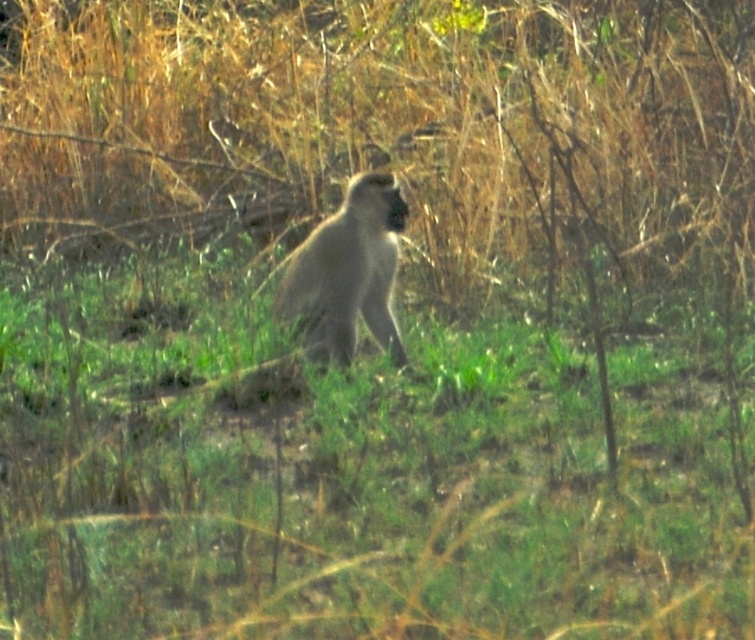
You are a small animal trying to hide from predators. You see the gray fur monkey at center and the green grassy at center. Which location would provide better cover?

The green grassy at center is much taller than the gray fur monkey at center, so it would provide better cover for hiding from predators.

You are a photographer trying to capture a clear shot of the gray fur monkey at center. Since the green grassy at center is in the way, can you adjust your position to avoid it?

The green grassy at center is located below the gray fur monkey at center, so you can adjust your position to aim slightly upward to avoid the grass and get a clear shot of the gray fur monkey at center.